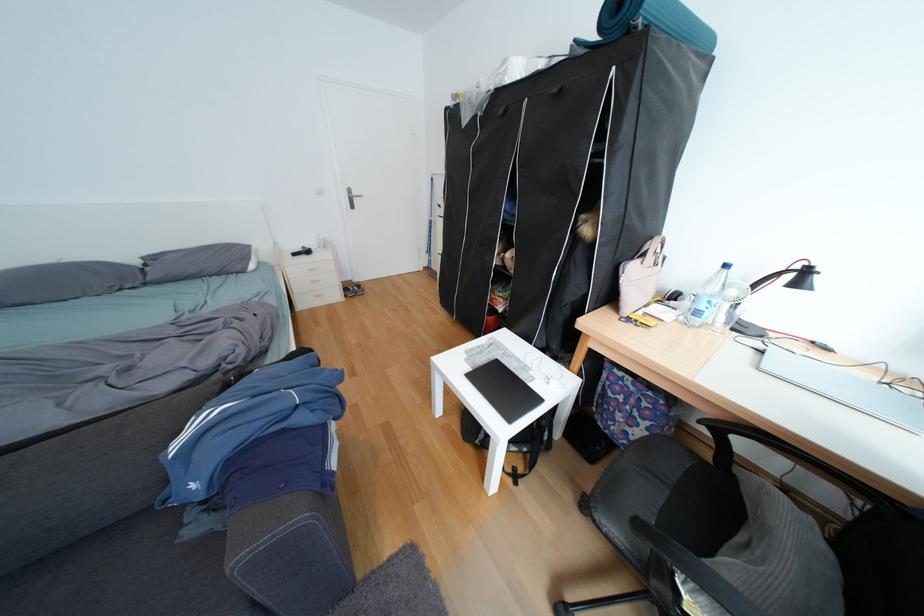
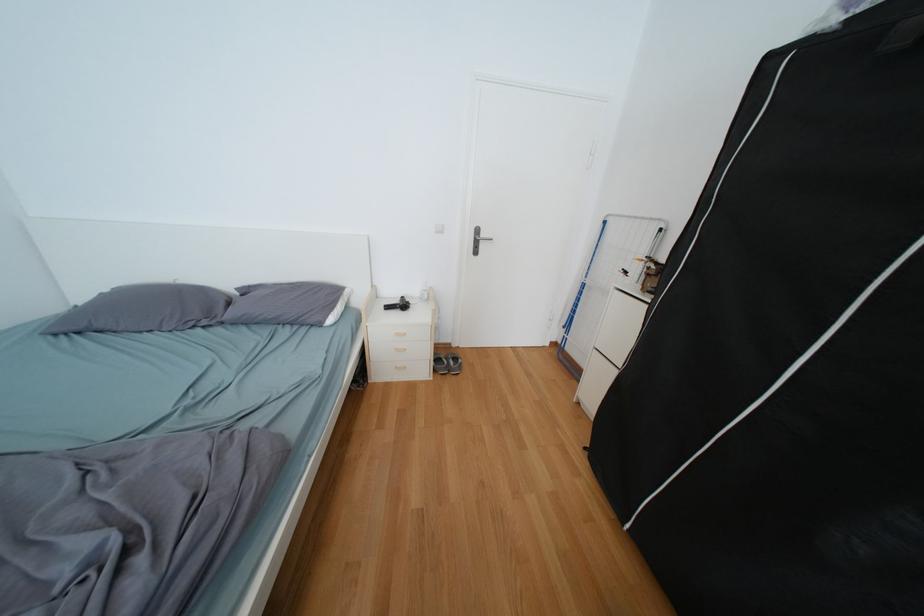
Find the pixel in the second image that matches point 322,270 in the first image.

(409, 334)